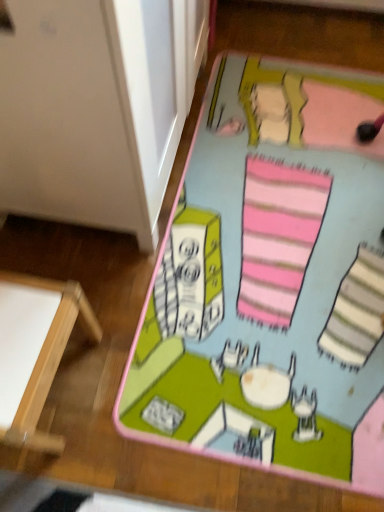
What is the approximate height of white wood table at lower left?

The height of white wood table at lower left is 19.99 inches.

At what (x,y) coordinates should I click in order to perform the action: click on white wood table at lower left. Please return your answer as a coordinate pair (x, y). This screenshot has width=384, height=512. Looking at the image, I should click on (47, 358).

This screenshot has width=384, height=512. Describe the element at coordinates (47, 358) in the screenshot. I see `white wood table at lower left` at that location.

The width and height of the screenshot is (384, 512). I want to click on white wood table at lower left, so click(x=47, y=358).